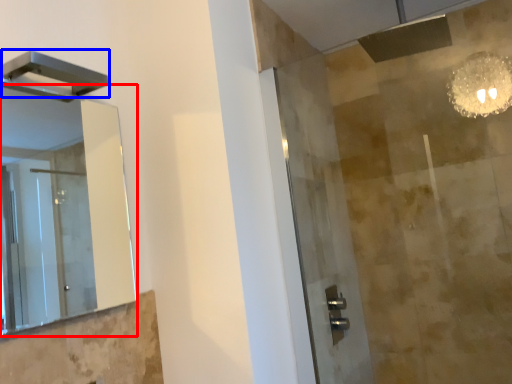
Question: Among these objects, which one is farthest to the camera, mirror (highlighted by a red box) or shower (highlighted by a blue box)?

Choices:
 (A) mirror
 (B) shower

Answer: (B)